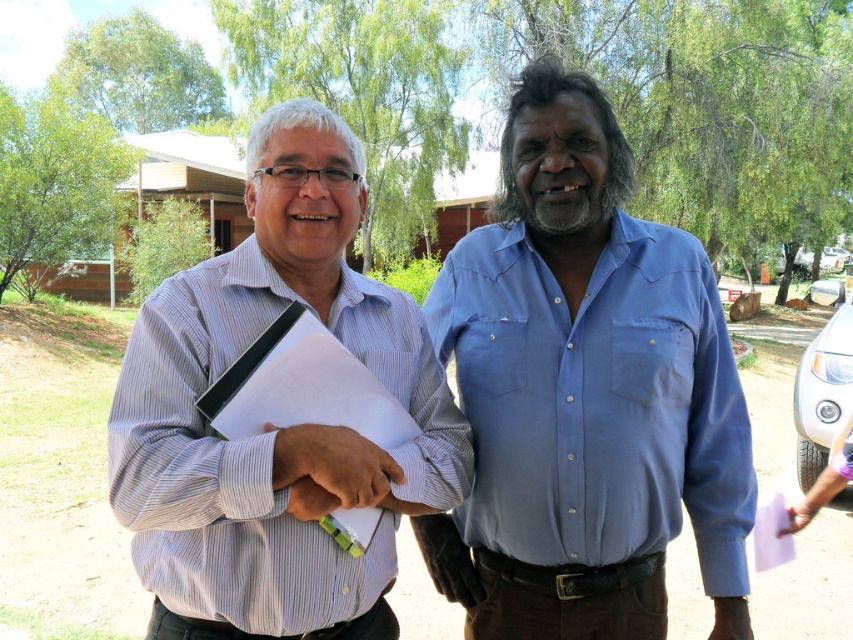
Is blue cotton shirt at center to the left of white paper at left from the viewer's perspective?

No, blue cotton shirt at center is not to the left of white paper at left.

Between blue cotton shirt at center and white paper at left, which one appears on the left side from the viewer's perspective?

From the viewer's perspective, white paper at left appears more on the left side.

Where is `blue cotton shirt at center`? The height and width of the screenshot is (640, 853). blue cotton shirt at center is located at coordinates (596, 403).

This screenshot has height=640, width=853. I want to click on blue cotton shirt at center, so click(596, 403).

Which is below, white striped shirt at left or blue cotton shirt at center?

Positioned lower is blue cotton shirt at center.

Which is in front, point (248, 552) or point (700, 246)?

Point (248, 552) is more forward.

Does point (445, 396) come behind point (653, 262)?

That is False.

What are the coordinates of `white striped shirt at left` in the screenshot? It's located at (274, 422).

Can you confirm if white striped shirt at left is smaller than white paper at left?

No, white striped shirt at left is not smaller than white paper at left.

Based on the photo, can you confirm if white striped shirt at left is positioned to the right of white paper at left?

No, white striped shirt at left is not to the right of white paper at left.

Which is in front, point (177, 449) or point (260, 356)?

Point (177, 449) is more forward.

Find the location of a particular element. This screenshot has width=853, height=640. white striped shirt at left is located at coordinates (274, 422).